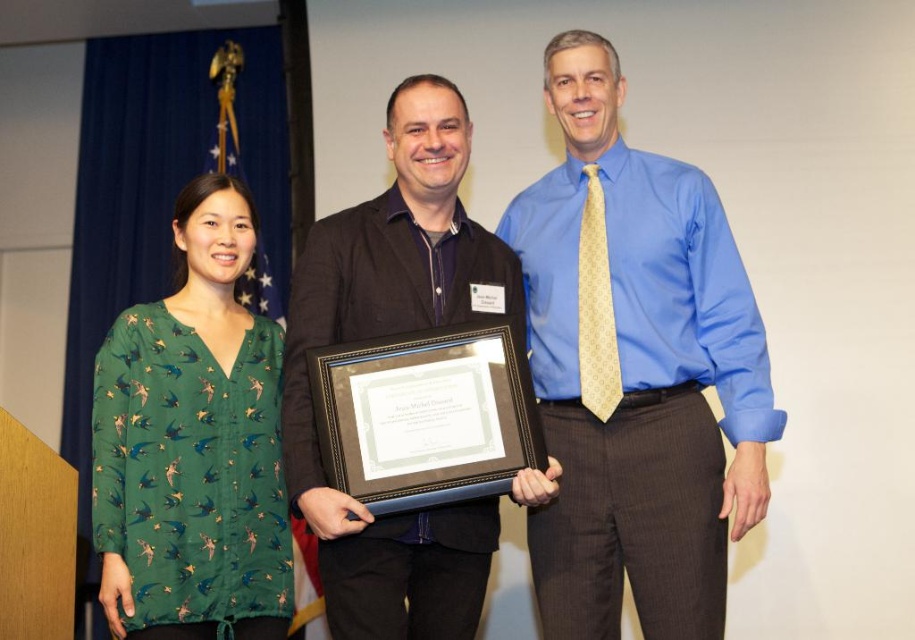
Question: Which object appears closest to the camera in this image?

Choices:
 (A) green printed blouse at left
 (B) black matte suit at center
 (C) blue silk shirt at center

Answer: (B)

Question: Is green printed blouse at left wider than black matte suit at center?

Choices:
 (A) yes
 (B) no

Answer: (B)

Question: Is blue silk shirt at center wider than green printed blouse at left?

Choices:
 (A) yes
 (B) no

Answer: (A)

Question: Which object is farther from the camera taking this photo?

Choices:
 (A) black matte suit at center
 (B) blue silk shirt at center

Answer: (B)

Question: Estimate the real-world distances between objects in this image. Which object is farther from the black matte suit at center?

Choices:
 (A) green printed blouse at left
 (B) blue silk shirt at center

Answer: (A)

Question: Is blue silk shirt at center further to camera compared to black matte suit at center?

Choices:
 (A) yes
 (B) no

Answer: (A)